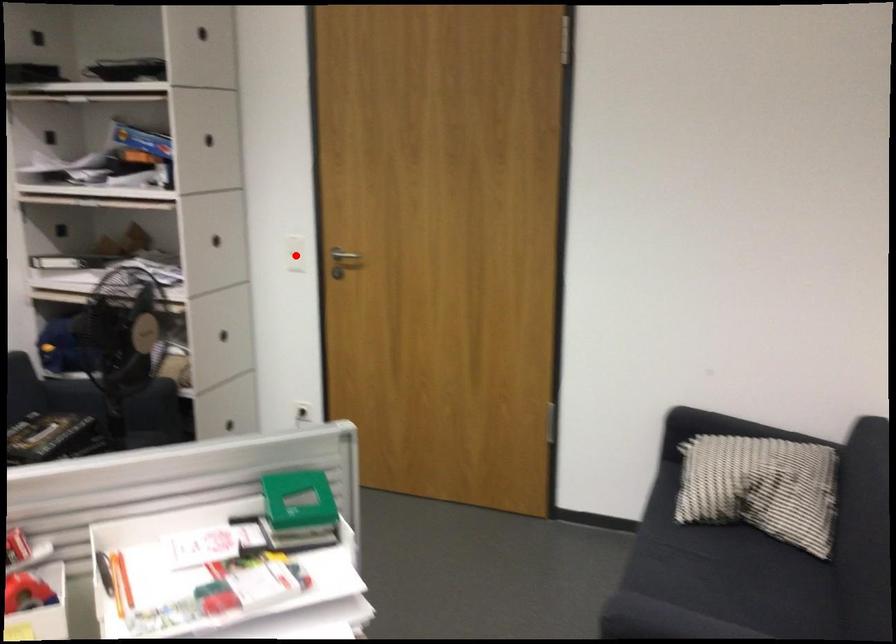
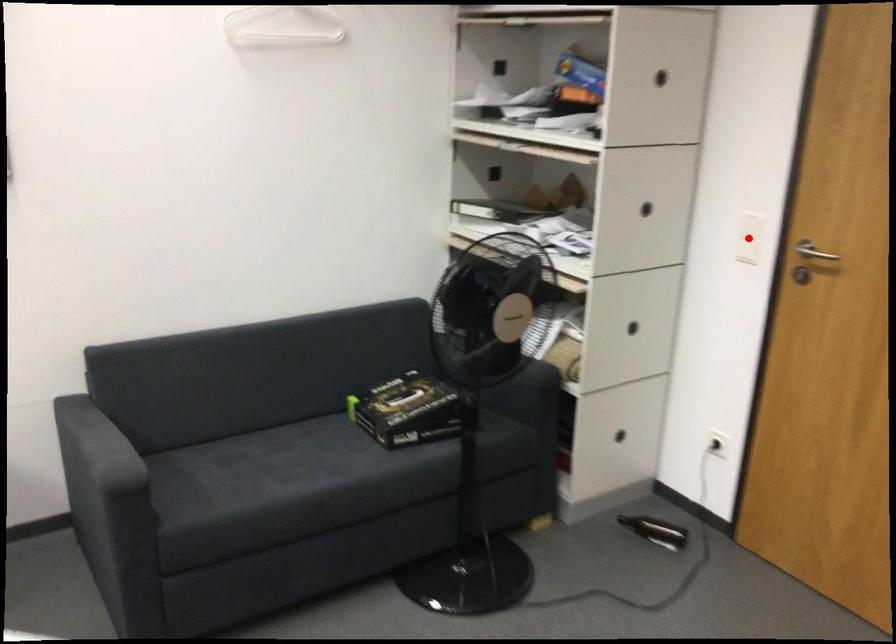
I am providing you with two images of the same scene from different viewpoints. A red point is marked on the first image and another point is marked on the second image. Are the points marked in image1 and image2 representing the same 3D position?

Yes